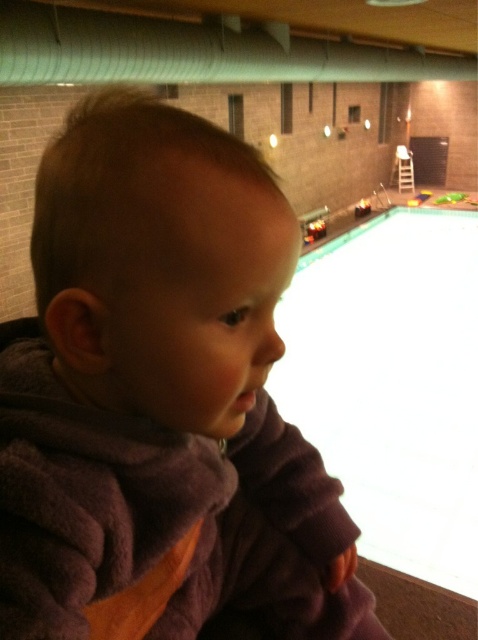
Does purple fleece toddler at center have a greater height compared to white smooth water at center?

Yes.

Between point (284, 456) and point (453, 483), which one is positioned behind?

The point (453, 483) is more distant.

Locate an element on the screen. Image resolution: width=478 pixels, height=640 pixels. purple fleece toddler at center is located at coordinates 161,397.